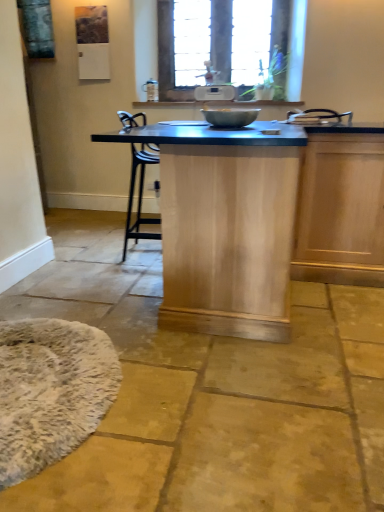
Question: From the image's perspective, is natural wood table at center over metallic silver mixing bowl at center?

Choices:
 (A) no
 (B) yes

Answer: (A)

Question: Is natural wood table at center thinner than metallic silver mixing bowl at center?

Choices:
 (A) yes
 (B) no

Answer: (B)

Question: Does natural wood table at center have a greater height compared to metallic silver mixing bowl at center?

Choices:
 (A) yes
 (B) no

Answer: (A)

Question: Is there a large distance between natural wood table at center and metallic silver mixing bowl at center?

Choices:
 (A) no
 (B) yes

Answer: (A)

Question: Is the surface of natural wood table at center in direct contact with metallic silver mixing bowl at center?

Choices:
 (A) no
 (B) yes

Answer: (A)

Question: Is wooden frame at upper center taller or shorter than metallic silver mixing bowl at center?

Choices:
 (A) short
 (B) tall

Answer: (B)

Question: From the image's perspective, is wooden frame at upper center above or below metallic silver mixing bowl at center?

Choices:
 (A) above
 (B) below

Answer: (A)

Question: Does point (187, 87) appear closer or farther from the camera than point (215, 122)?

Choices:
 (A) closer
 (B) farther

Answer: (B)

Question: Is wooden frame at upper center in front of or behind metallic silver mixing bowl at center in the image?

Choices:
 (A) front
 (B) behind

Answer: (B)

Question: Would you say natural wood table at center is inside or outside metallic silver mixing bowl at center?

Choices:
 (A) inside
 (B) outside

Answer: (B)

Question: In terms of width, does natural wood table at center look wider or thinner when compared to metallic silver mixing bowl at center?

Choices:
 (A) wide
 (B) thin

Answer: (A)

Question: From a real-world perspective, is natural wood table at center physically located above or below metallic silver mixing bowl at center?

Choices:
 (A) above
 (B) below

Answer: (B)

Question: Is point (196, 312) closer or farther from the camera than point (205, 114)?

Choices:
 (A) closer
 (B) farther

Answer: (A)

Question: Is natural wood table at center to the left or to the right of white fluffy mat at lower left in the image?

Choices:
 (A) left
 (B) right

Answer: (B)

Question: Is point (226, 161) positioned closer to the camera than point (48, 415)?

Choices:
 (A) farther
 (B) closer

Answer: (A)